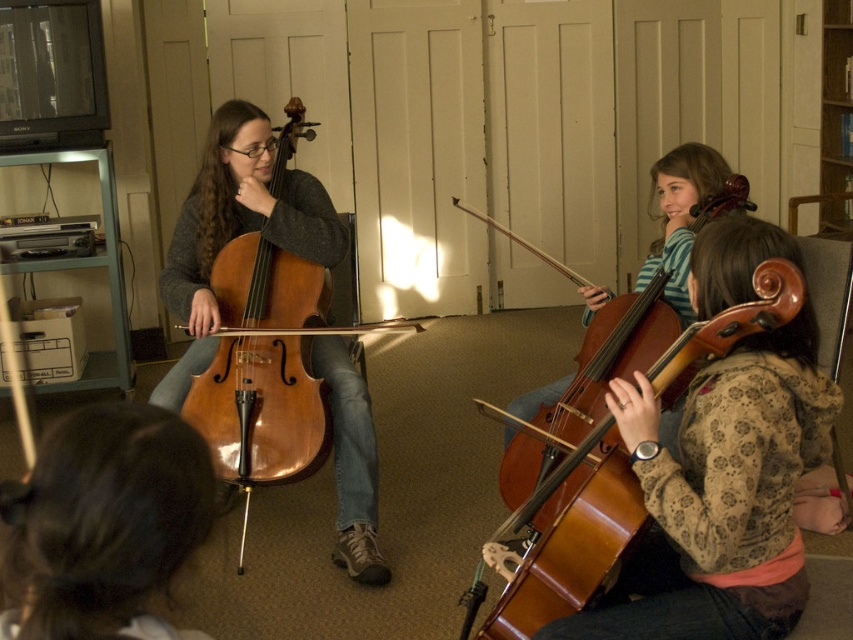
Which is more to the left, wooden violin at center or wooden bookshelf at upper right?

Positioned to the left is wooden violin at center.

Does point (605, 532) come in front of point (849, 230)?

Yes.

Is point (518, 628) farther from camera compared to point (848, 45)?

That is False.

The height and width of the screenshot is (640, 853). Identify the location of wooden violin at center. (614, 452).

Looking at this image, which is more to the right, shiny brown wood cello at left or wooden bookshelf at upper right?

Positioned to the right is wooden bookshelf at upper right.

Does point (281, 145) come closer to viewer compared to point (824, 72)?

That is True.

In order to click on shiny brown wood cello at left in this screenshot , I will do point(263,369).

Who is more forward, (544, 515) or (828, 3)?

Point (544, 515)

Which of these two, wooden polished cello at center or wooden bookshelf at upper right, stands shorter?

wooden polished cello at center

Measure the distance between point (677, 332) and camera.

Point (677, 332) and camera are 7.04 feet apart from each other.

Where is `wooden polished cello at center`? The image size is (853, 640). wooden polished cello at center is located at coordinates (612, 355).